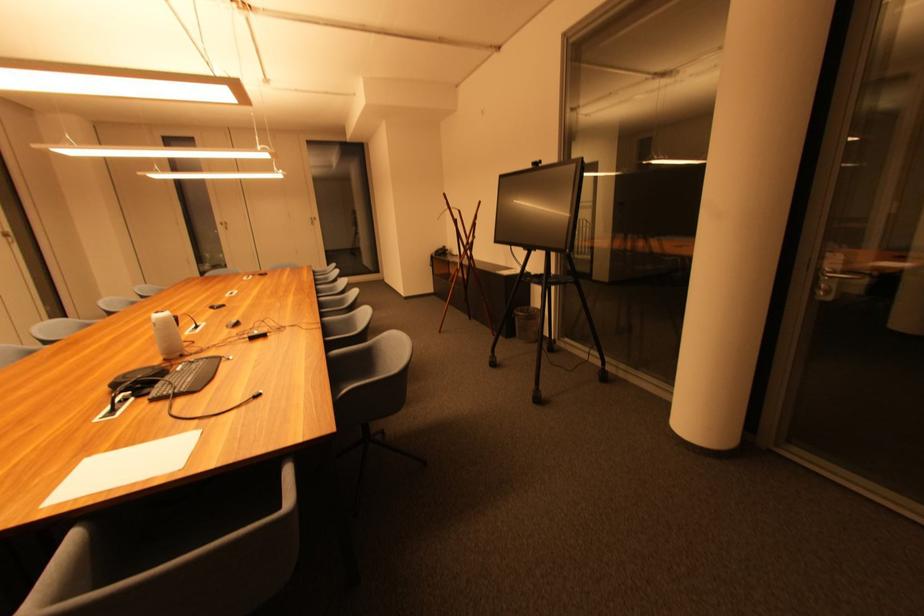
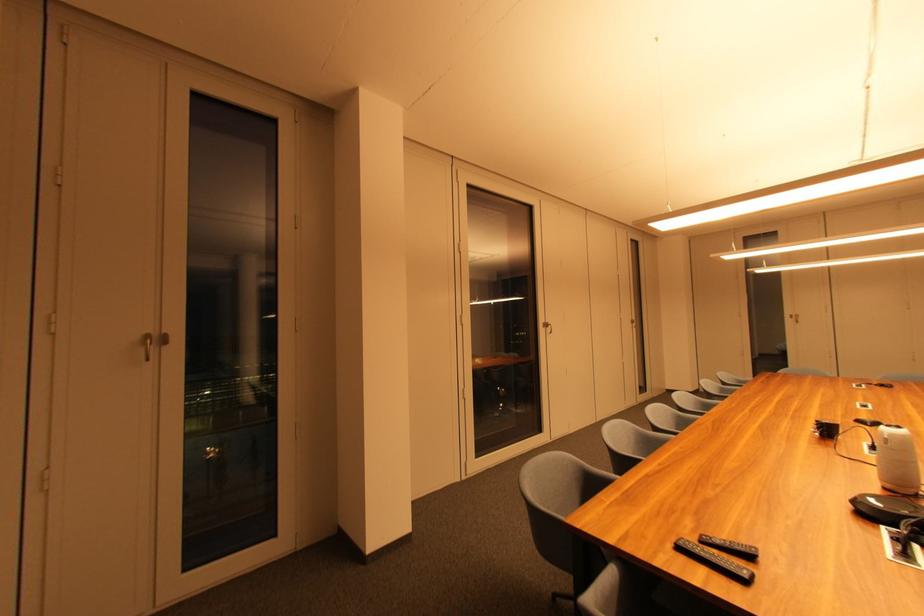
Question: The first image is from the beginning of the video and the second image is from the end. How did the camera likely rotate when shooting the video?

Choices:
 (A) Left
 (B) Right
 (C) Up
 (D) Down

Answer: (A)